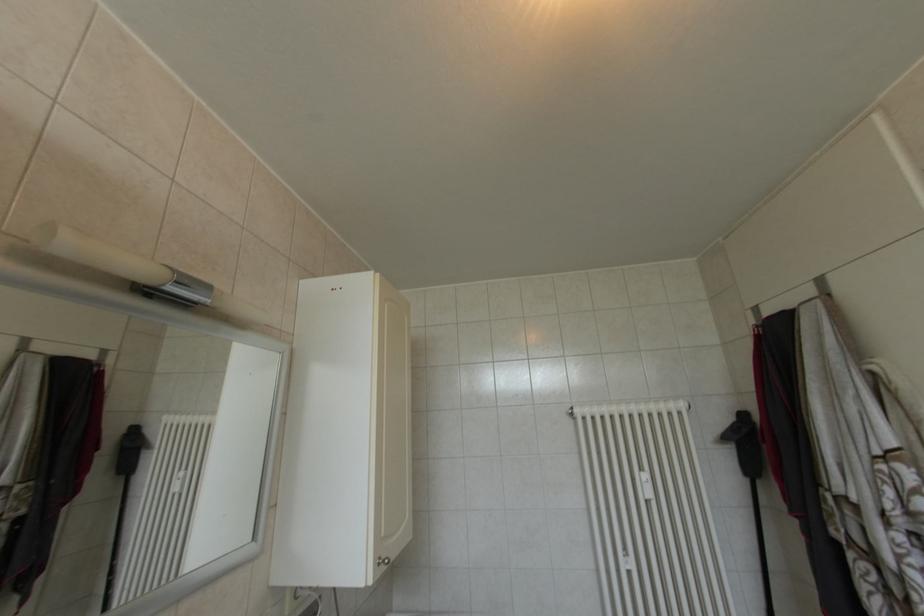
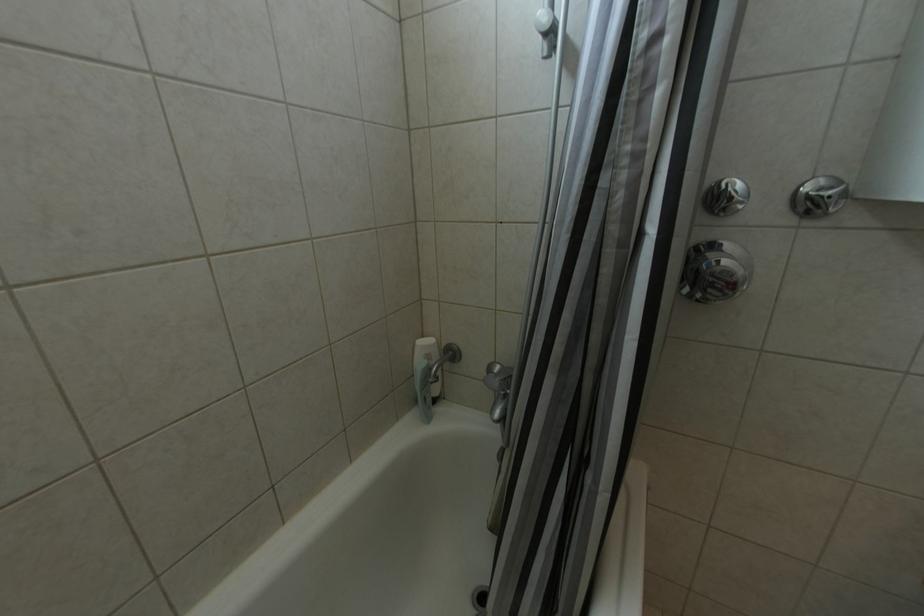
Question: How did the camera likely rotate?

Choices:
 (A) Left
 (B) Right
 (C) Up
 (D) Down

Answer: (A)